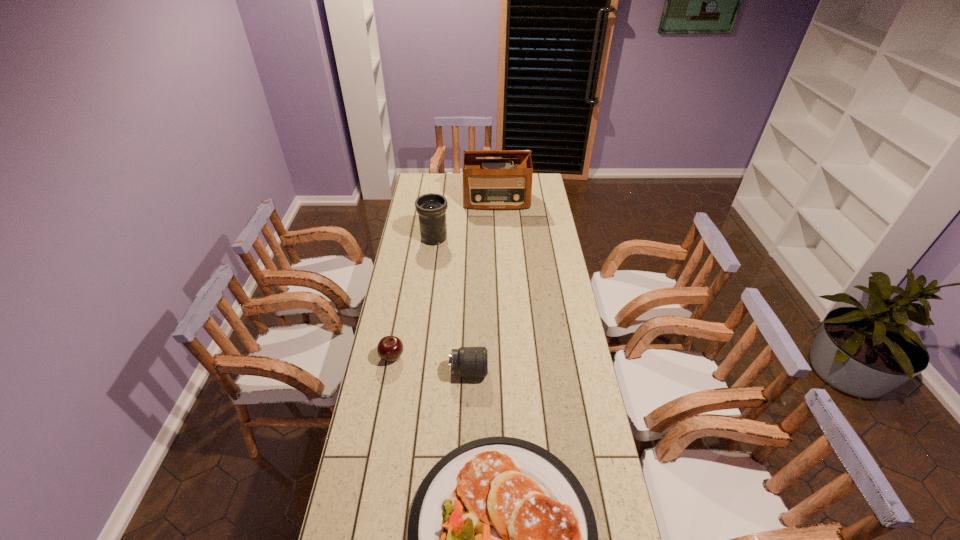
This screenshot has height=540, width=960. What are the coordinates of `blank space located 0.210m on the back of the apple` in the screenshot? It's located at (401, 308).

Where is `object that is at the far edge`? The width and height of the screenshot is (960, 540). object that is at the far edge is located at coordinates (497, 183).

At what (x,y) coordinates should I click in order to perform the action: click on telephoto lens that is at the left edge. Please return your answer as a coordinate pair (x, y). Looking at the image, I should click on (431, 208).

Find the location of a particular element. The height and width of the screenshot is (540, 960). apple situated at the left edge is located at coordinates (390, 348).

Locate an element on the screen. The width and height of the screenshot is (960, 540). object present at the right edge is located at coordinates (497, 183).

Identify the location of object at the far right corner. The height and width of the screenshot is (540, 960). (497, 183).

In the image, there is a desktop. At what (x,y) coordinates should I click in order to perform the action: click on vacant area at the far edge. Please return your answer as a coordinate pair (x, y). This screenshot has width=960, height=540. Looking at the image, I should click on (449, 178).

I want to click on vacant region at the left edge of the desktop, so [x=403, y=230].

Locate an element on the screen. This screenshot has width=960, height=540. vacant space at the right edge is located at coordinates (531, 268).

This screenshot has height=540, width=960. In the image, there is a desktop. Identify the location of free space at the far left corner. (422, 179).